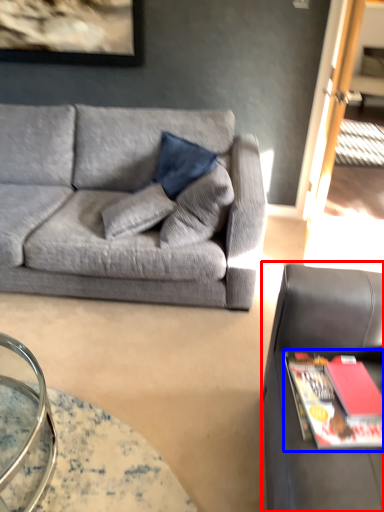
Question: Which point is closer to the camera, studio couch (highlighted by a red box) or magazine (highlighted by a blue box)?

Choices:
 (A) studio couch
 (B) magazine

Answer: (A)